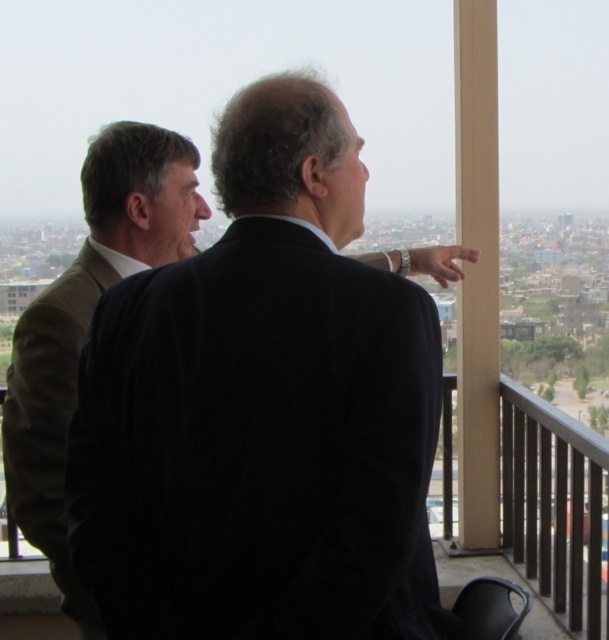
You are standing on the balcony and want to move from the chair in the bottom right corner to the railing. There are two points marked as point 1 at coordinates point (406, 595) and point 2 at coordinates point (16, 408). Which point should you avoid stepping on to reach the railing safely?

You should avoid stepping on point 2 at coordinates point (16, 408) because point 1 at coordinates point (406, 595) is in front of it, so stepping on point 2 might be an obstacle or not on the path to the railing.

You are an interior designer observing the balcony setup. You need to determine if the black matte suit at upper center can be moved to the right side without disturbing the brown woolen suit at left. Can you confirm if there is enough space between them?

The black matte suit at upper center is positioned under the brown woolen suit at left, so moving it to the right side would require space between them. However, since their positions are vertical rather than horizontal, there might be sufficient space to move the black matte suit at upper center to the right without affecting the brown woolen suit at left.